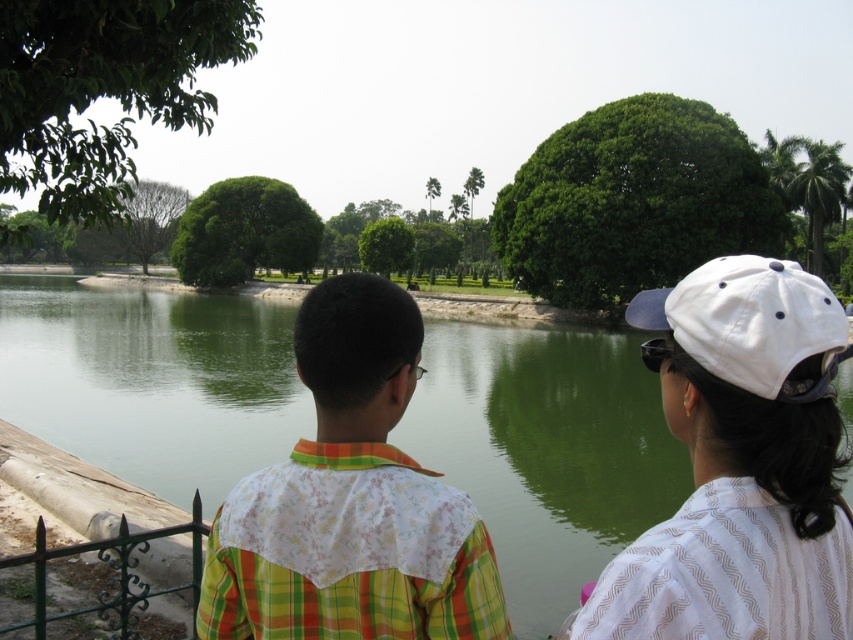
You are a photographer positioned at the origin point in this scene. You need to capture a photo of the green liquid water at center. What are the coordinates where you should aim your camera?

The coordinates to aim your camera are at point [546,451] to capture the green liquid water at center.

You are a photographer trying to capture a photo of the green liquid water at center and the floral fabric shirt at center. Since you want to focus on the water, which object should you position closer to the camera?

The green liquid water at center is taller than the floral fabric shirt at center, so to focus on the water, position the green liquid water at center closer to the camera to ensure it appears larger in the photo.